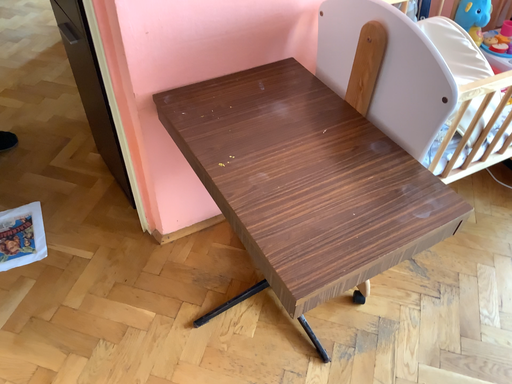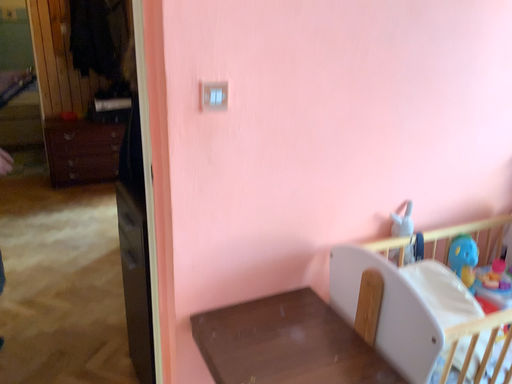
Question: Which way did the camera rotate in the video?

Choices:
 (A) rotated upward
 (B) rotated downward

Answer: (A)